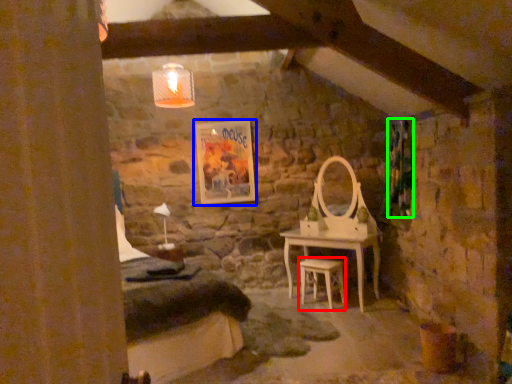
Question: Based on their relative distances, which object is nearer to stool (highlighted by a red box)? Choose from picture frame (highlighted by a blue box) and curtain (highlighted by a green box).

Choices:
 (A) picture frame
 (B) curtain

Answer: (B)